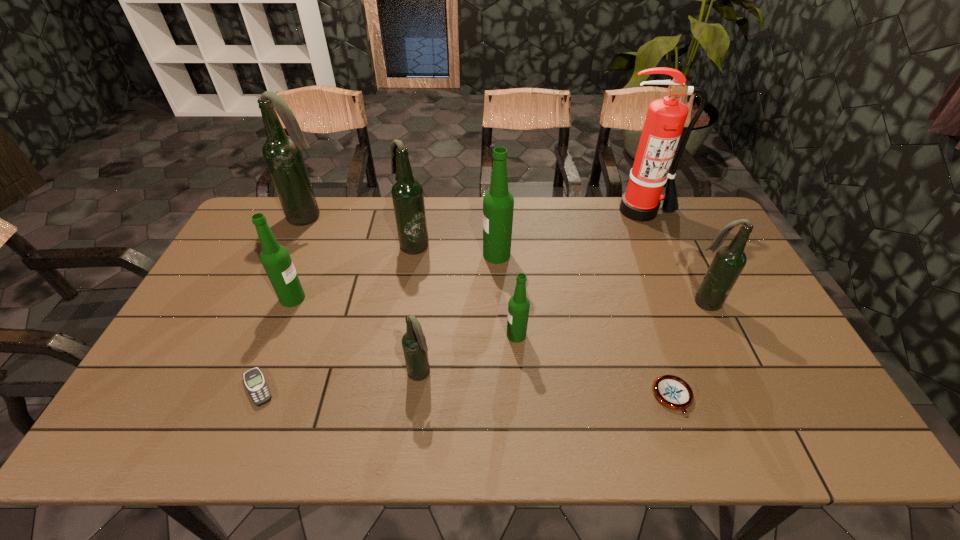
The width and height of the screenshot is (960, 540). In order to click on fire extinguisher situated at the far edge in this screenshot , I will do `click(665, 119)`.

You are a GUI agent. You are given a task and a screenshot of the screen. Output one action in this format:
    pyautogui.click(x=<x>, y=<y>)
    Task: Click on the object that is positioned at the near edge
    This screenshot has width=960, height=540.
    Given the screenshot: What is the action you would take?
    pyautogui.click(x=673, y=392)

The image size is (960, 540). Identify the location of object at the left edge. (282, 154).

Locate an element on the screen. The image size is (960, 540). fire extinguisher located in the right edge section of the desktop is located at coordinates (665, 119).

Locate an element on the screen. This screenshot has height=540, width=960. beer bottle located in the right edge section of the desktop is located at coordinates (729, 261).

Image resolution: width=960 pixels, height=540 pixels. I want to click on object at the far left corner, so click(x=282, y=154).

The width and height of the screenshot is (960, 540). In order to click on object that is at the far right corner in this screenshot , I will do `click(665, 119)`.

The image size is (960, 540). In the image, there is a desktop. Find the location of `free space at the far edge`. free space at the far edge is located at coordinates (331, 232).

Locate an element on the screen. Image resolution: width=960 pixels, height=540 pixels. free space at the near edge of the desktop is located at coordinates (620, 427).

This screenshot has height=540, width=960. In the image, there is a desktop. What are the coordinates of `vacant region at the left edge` in the screenshot? It's located at (224, 268).